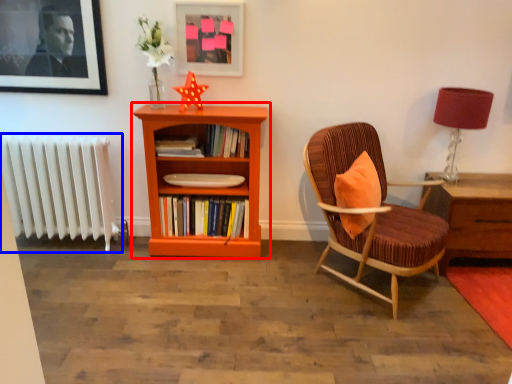
Question: Which object is further to the camera taking this photo, bookcase (highlighted by a red box) or radiator (highlighted by a blue box)?

Choices:
 (A) bookcase
 (B) radiator

Answer: (B)